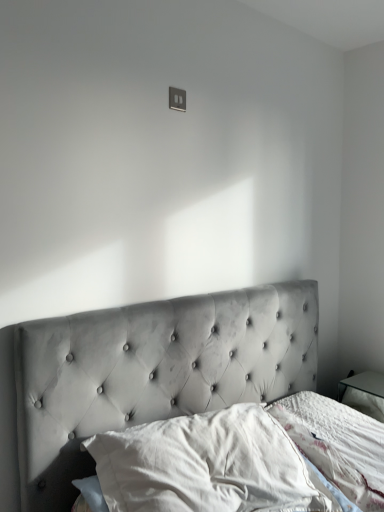
Question: Is matte gray switch at upper center to the right of white soft pillow at lower center from the viewer's perspective?

Choices:
 (A) no
 (B) yes

Answer: (A)

Question: Is matte gray switch at upper center outside of white soft pillow at lower center?

Choices:
 (A) yes
 (B) no

Answer: (A)

Question: Is matte gray switch at upper center turned away from white soft pillow at lower center?

Choices:
 (A) yes
 (B) no

Answer: (B)

Question: Does matte gray switch at upper center have a greater height compared to white soft pillow at lower center?

Choices:
 (A) no
 (B) yes

Answer: (A)

Question: Is matte gray switch at upper center thinner than white soft pillow at lower center?

Choices:
 (A) yes
 (B) no

Answer: (A)

Question: From a real-world perspective, is matte gray switch at upper center physically above white soft pillow at lower center?

Choices:
 (A) yes
 (B) no

Answer: (A)

Question: Is white soft pillow at lower center at the left side of matte gray switch at upper center?

Choices:
 (A) no
 (B) yes

Answer: (A)

Question: Is white soft pillow at lower center located outside matte gray switch at upper center?

Choices:
 (A) yes
 (B) no

Answer: (A)

Question: Does white soft pillow at lower center have a larger size compared to matte gray switch at upper center?

Choices:
 (A) yes
 (B) no

Answer: (A)

Question: Is white soft pillow at lower center behind matte gray switch at upper center?

Choices:
 (A) yes
 (B) no

Answer: (B)

Question: Considering the relative sizes of white soft pillow at lower center and matte gray switch at upper center in the image provided, is white soft pillow at lower center wider than matte gray switch at upper center?

Choices:
 (A) no
 (B) yes

Answer: (B)

Question: From the image's perspective, is white soft pillow at lower center beneath matte gray switch at upper center?

Choices:
 (A) no
 (B) yes

Answer: (B)

Question: In the image, is white soft pillow at lower center positioned in front of or behind matte gray switch at upper center?

Choices:
 (A) front
 (B) behind

Answer: (A)